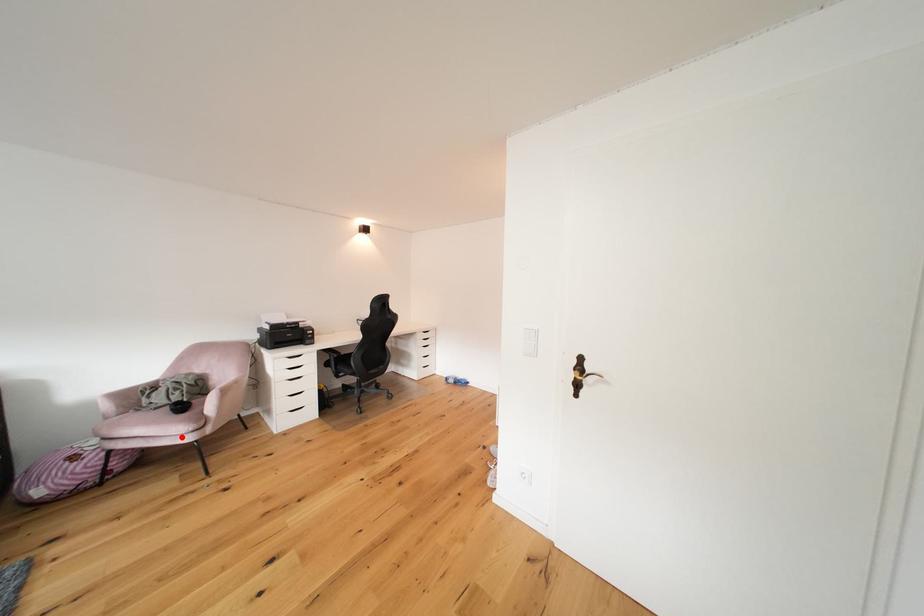
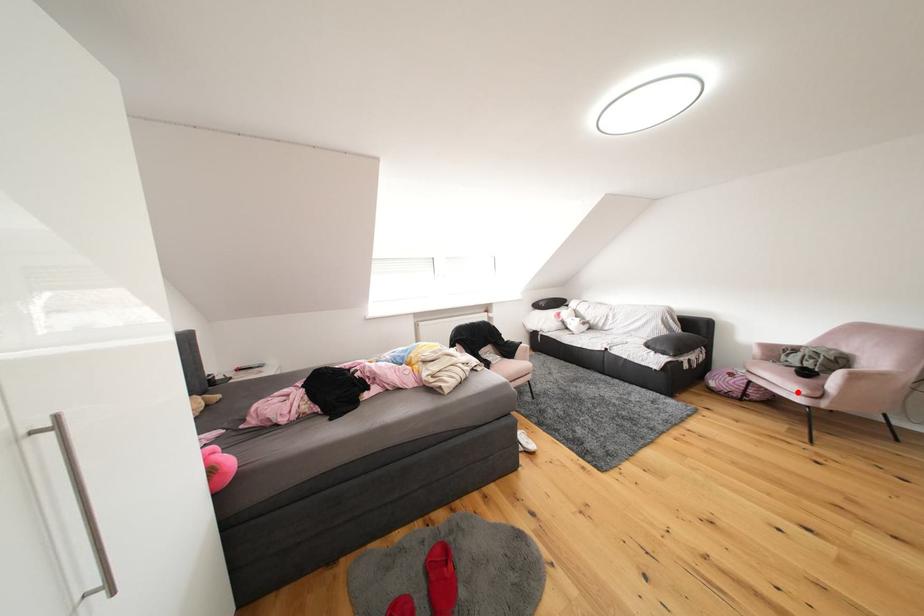
I am providing you with two images of the same scene from different viewpoints. A red point is marked on the first image and another point is marked on the second image. Do the highlighted points in image1 and image2 indicate the same real-world spot?

Yes